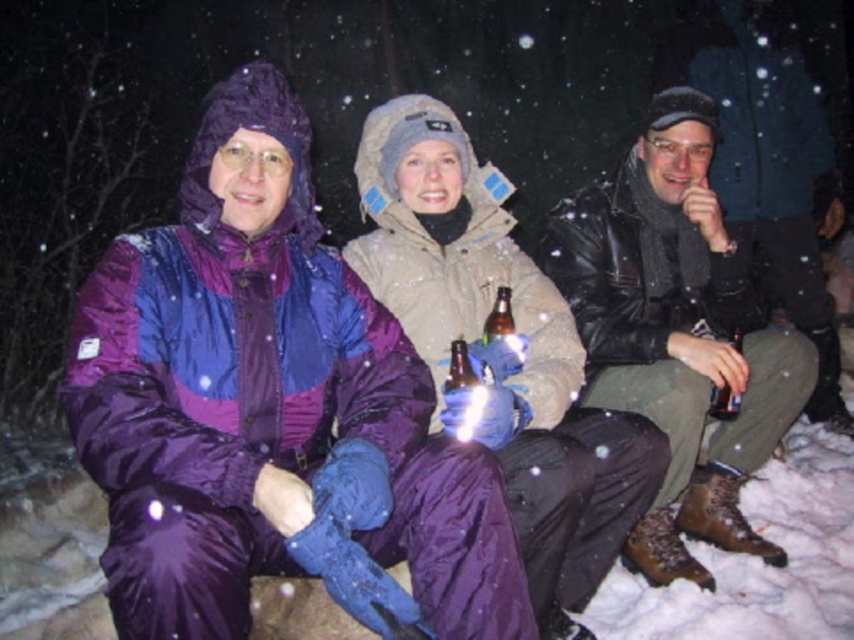
Who is taller, brown glass bottle at center or black plastic bottle at center?

With more height is black plastic bottle at center.

Does brown glass bottle at center have a smaller size compared to black plastic bottle at center?

Yes.

Between point (496, 321) and point (730, 417), which one is positioned in front?

Positioned in front is point (496, 321).

Locate an element on the screen. brown glass bottle at center is located at coordinates (499, 316).

Can you confirm if purple nylon jacket at center is shorter than black plastic bottle at center?

No.

Which is below, purple nylon jacket at center or black plastic bottle at center?

Positioned lower is black plastic bottle at center.

The image size is (854, 640). I want to click on purple nylon jacket at center, so click(x=264, y=401).

Can you confirm if purple nylon jacket at center is smaller than brown glass bottle at center?

Incorrect, purple nylon jacket at center is not smaller in size than brown glass bottle at center.

Consider the image. Is purple nylon jacket at center below brown glass bottle at center?

Yes.

Which is behind, point (137, 422) or point (501, 304)?

The point (501, 304) is behind.

Where is `purple nylon jacket at center`? This screenshot has width=854, height=640. purple nylon jacket at center is located at coordinates (264, 401).